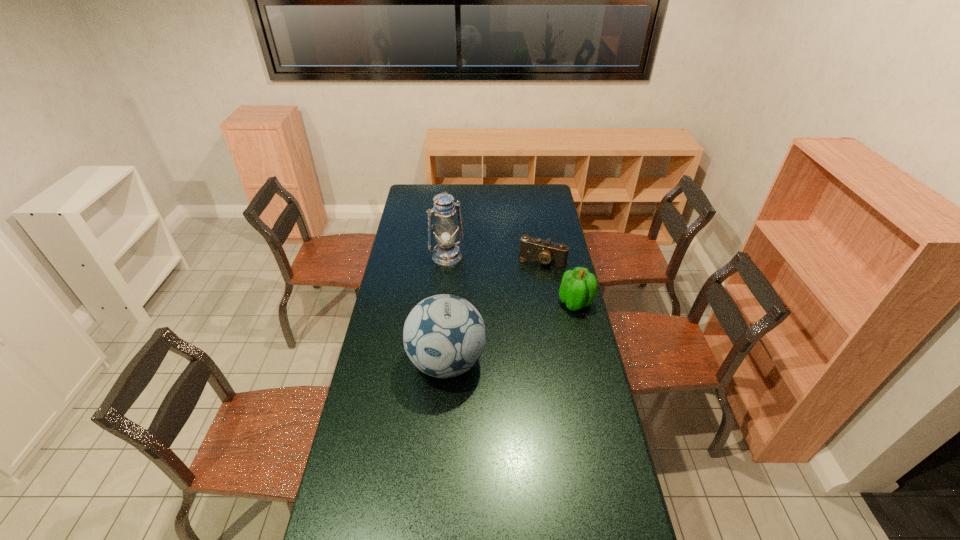
Identify the location of object that is the third closest to the shortest object. (444, 335).

Where is `free space that satisfies the following two spatial constraints: 1. on the front side of the second nearest object; 2. on the right side of the lantern`? free space that satisfies the following two spatial constraints: 1. on the front side of the second nearest object; 2. on the right side of the lantern is located at coordinates (x=443, y=302).